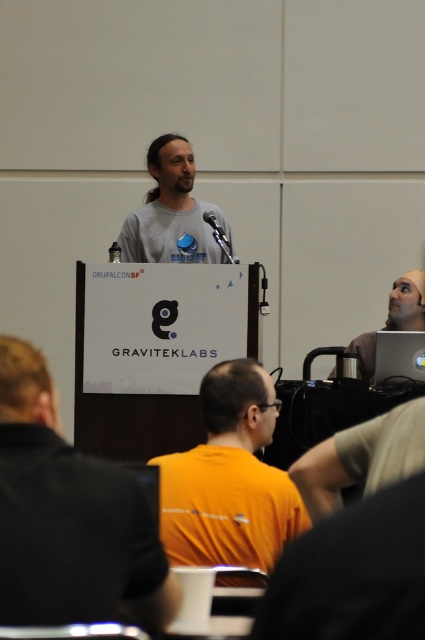
Is matte black laptop at upper right positioned at the back of black plastic laptop at lower right?

Yes, matte black laptop at upper right is behind black plastic laptop at lower right.

Can you confirm if matte black laptop at upper right is wider than black plastic laptop at lower right?

Yes.

Is point (388, 316) less distant than point (382, 362)?

That is False.

Identify the location of matte black laptop at upper right. The image size is (425, 640). (407, 301).

Who is taller, black matte shirt at left or orange matte shirt at center?

Standing taller between the two is orange matte shirt at center.

Is point (113, 476) less distant than point (248, 426)?

That is True.

Find the location of a particular element. black matte shirt at left is located at coordinates [68, 516].

Between point (39, 451) and point (421, 339), which one is positioned behind?

Positioned behind is point (421, 339).

Is point (44, 529) positioned in front of point (384, 378)?

Yes, it is in front of point (384, 378).

The height and width of the screenshot is (640, 425). In order to click on black matte shirt at left in this screenshot , I will do `click(68, 516)`.